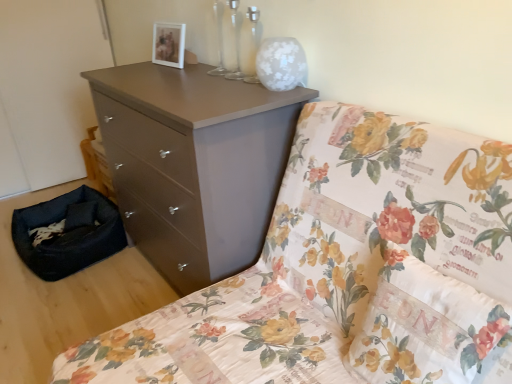
The height and width of the screenshot is (384, 512). I want to click on matte brown chest of drawers at upper center, so click(x=194, y=163).

Where is `black fabric pet bed at lower left`? This screenshot has height=384, width=512. black fabric pet bed at lower left is located at coordinates (69, 233).

I want to click on matte brown dresser at center, so click(x=347, y=270).

From a real-world perspective, who is located lower, matte brown dresser at center or black fabric pet bed at lower left?

black fabric pet bed at lower left.

I want to click on footrest above the matte brown dresser at center (from the image's perspective), so click(x=69, y=233).

From the image's perspective, is matte brown dresser at center above or below black fabric pet bed at lower left?

matte brown dresser at center is situated lower than black fabric pet bed at lower left in the image.

Which object is further away from the camera taking this photo, matte brown dresser at center or black fabric pet bed at lower left?

black fabric pet bed at lower left is further from the camera.

Is matte brown dresser at center far from floral fabric pillow at center?

That's not correct — matte brown dresser at center is a little close to floral fabric pillow at center.

Is matte brown dresser at center positioned beyond the bounds of floral fabric pillow at center?

Yes, matte brown dresser at center is not within floral fabric pillow at center.

Considering the points (315, 121) and (508, 370), which point is in front, point (315, 121) or point (508, 370)?

The point (508, 370) is more forward.

Is floral fabric pillow at center located outside matte brown chest of drawers at upper center?

Yes.

Does floral fabric pillow at center touch matte brown chest of drawers at upper center?

No, floral fabric pillow at center is not in contact with matte brown chest of drawers at upper center.

Which is more to the left, floral fabric pillow at center or matte brown chest of drawers at upper center?

matte brown chest of drawers at upper center.

Can we say matte brown dresser at center lies outside matte brown chest of drawers at upper center?

Yes, matte brown dresser at center is outside of matte brown chest of drawers at upper center.

Looking at this image, can you confirm if matte brown dresser at center is bigger than matte brown chest of drawers at upper center?

Yes, matte brown dresser at center is bigger than matte brown chest of drawers at upper center.

Considering the relative positions of matte brown dresser at center and matte brown chest of drawers at upper center in the image provided, is matte brown dresser at center to the right of matte brown chest of drawers at upper center from the viewer's perspective?

Indeed, matte brown dresser at center is positioned on the right side of matte brown chest of drawers at upper center.

From a real-world perspective, is black fabric pet bed at lower left physically located above or below matte brown chest of drawers at upper center?

black fabric pet bed at lower left is situated lower than matte brown chest of drawers at upper center in the real world.

Is black fabric pet bed at lower left shorter than matte brown chest of drawers at upper center?

Indeed, black fabric pet bed at lower left has a lesser height compared to matte brown chest of drawers at upper center.

Is black fabric pet bed at lower left positioned far away from matte brown chest of drawers at upper center?

No, there isn't a large distance between black fabric pet bed at lower left and matte brown chest of drawers at upper center.

From a real-world perspective, is matte brown chest of drawers at upper center positioned above or below floral fabric pillow at center?

matte brown chest of drawers at upper center is below floral fabric pillow at center.

Considering the relative positions of matte brown chest of drawers at upper center and floral fabric pillow at center in the image provided, is matte brown chest of drawers at upper center behind floral fabric pillow at center?

That is True.

You are a GUI agent. You are given a task and a screenshot of the screen. Output one action in this format:
    pyautogui.click(x=<x>, y=<y>)
    Task: Click on the chest of drawers that is under the floral fabric pillow at center (from a real-world perspective)
    This screenshot has height=384, width=512.
    Given the screenshot: What is the action you would take?
    pyautogui.click(x=194, y=163)

Does matte brown chest of drawers at upper center contain floral fabric pillow at center?

Actually, floral fabric pillow at center is outside matte brown chest of drawers at upper center.

In order to click on furniture lying in front of the matte brown chest of drawers at upper center in this screenshot , I will do `click(347, 270)`.

Is matte brown chest of drawers at upper center directly adjacent to matte brown dresser at center?

No, matte brown chest of drawers at upper center is not touching matte brown dresser at center.

What are the coordinates of `furniture on the right of black fabric pet bed at lower left` in the screenshot? It's located at (347, 270).

Where is `pillow below the matte brown dresser at center (from the image's perspective)`? pillow below the matte brown dresser at center (from the image's perspective) is located at coordinates (432, 331).

Looking at the image, which one is located closer to matte brown dresser at center, black fabric pet bed at lower left or matte brown chest of drawers at upper center?

The object closer to matte brown dresser at center is matte brown chest of drawers at upper center.

Estimate the real-world distances between objects in this image. Which object is closer to matte brown dresser at center, black fabric pet bed at lower left or floral fabric pillow at center?

floral fabric pillow at center is positioned closer to the anchor matte brown dresser at center.

Considering their positions, is black fabric pet bed at lower left positioned closer to matte brown chest of drawers at upper center than floral fabric pillow at center?

black fabric pet bed at lower left is positioned closer to the anchor matte brown chest of drawers at upper center.

When comparing their distances from floral fabric pillow at center, does matte brown dresser at center or matte brown chest of drawers at upper center seem closer?

matte brown dresser at center is positioned closer to the anchor floral fabric pillow at center.

Estimate the real-world distances between objects in this image. Which object is further from matte brown chest of drawers at upper center, matte brown dresser at center or black fabric pet bed at lower left?

black fabric pet bed at lower left is positioned further to the anchor matte brown chest of drawers at upper center.

Estimate the real-world distances between objects in this image. Which object is closer to floral fabric pillow at center, matte brown chest of drawers at upper center or black fabric pet bed at lower left?

matte brown chest of drawers at upper center.

When comparing their distances from floral fabric pillow at center, does black fabric pet bed at lower left or matte brown chest of drawers at upper center seem further?

black fabric pet bed at lower left.

Which object lies nearer to the anchor point matte brown dresser at center, matte brown chest of drawers at upper center or black fabric pet bed at lower left?

matte brown chest of drawers at upper center is positioned closer to the anchor matte brown dresser at center.

This screenshot has height=384, width=512. Identify the location of chest of drawers between matte brown dresser at center and black fabric pet bed at lower left along the z-axis. click(x=194, y=163).

The width and height of the screenshot is (512, 384). I want to click on the chest of drawers located between black fabric pet bed at lower left and floral fabric pillow at center in the left-right direction, so click(194, 163).

Image resolution: width=512 pixels, height=384 pixels. What are the coordinates of `pillow between matte brown dresser at center and black fabric pet bed at lower left along the z-axis` in the screenshot? It's located at coord(432,331).

Where is `pillow between matte brown dresser at center and matte brown chest of drawers at upper center in the front-back direction`? pillow between matte brown dresser at center and matte brown chest of drawers at upper center in the front-back direction is located at coordinates click(x=432, y=331).